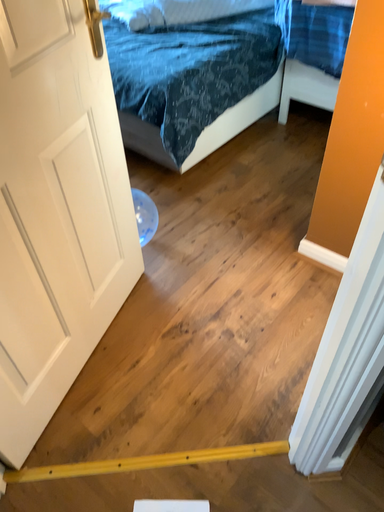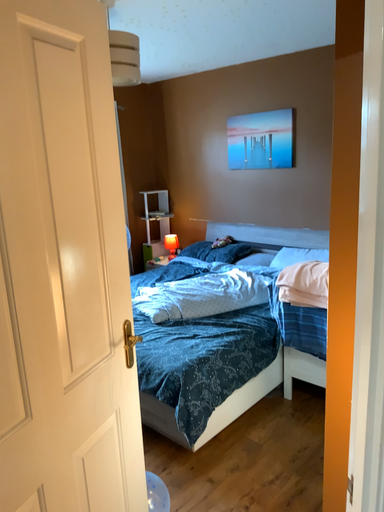
Question: Which way did the camera rotate in the video?

Choices:
 (A) rotated upward
 (B) rotated downward

Answer: (A)